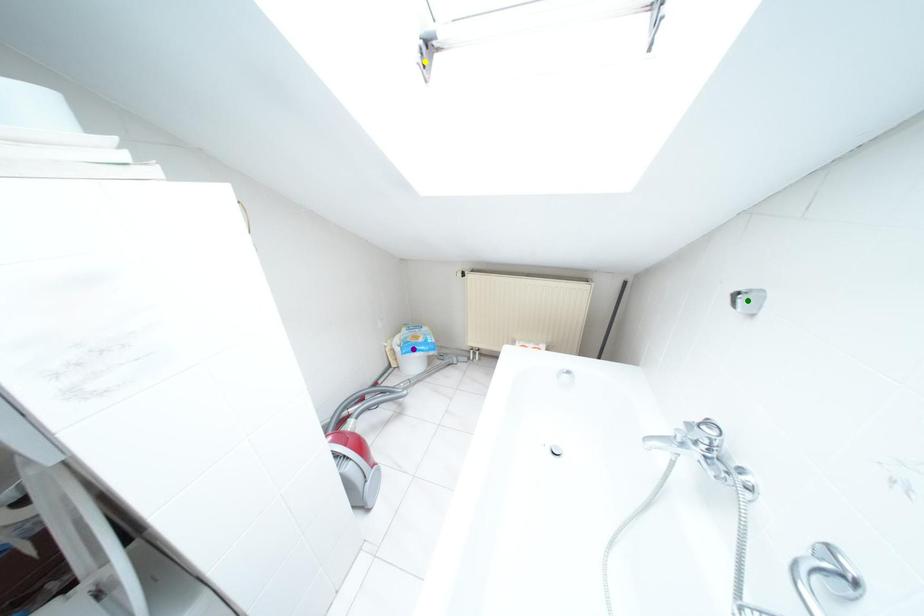
Order these from farthest to nearest:
green point, yellow point, purple point

purple point → yellow point → green point